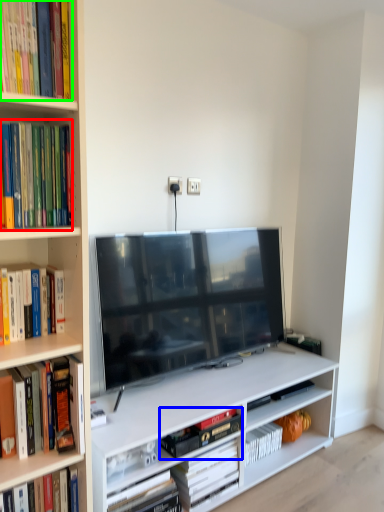
Question: Which object is the closest to the book (highlighted by a red box)? Choose among these: book (highlighted by a blue box) or book (highlighted by a green box).

Choices:
 (A) book
 (B) book

Answer: (B)